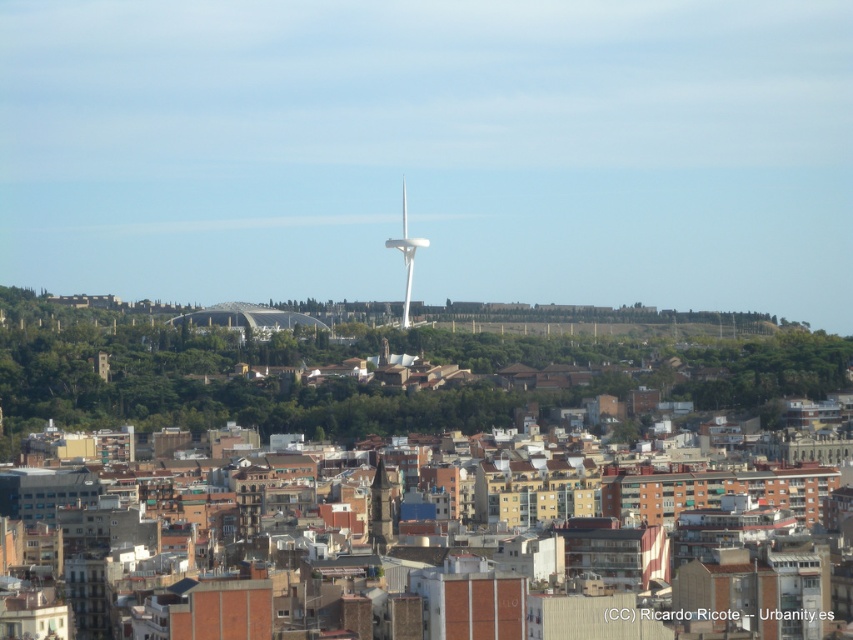
You are standing at the vantage point overlooking the city. You notice two points marked in the image. Which point, point (373, 538) or point (405, 237), is closer to your current position?

Point (373, 538) is closer to the camera than point (405, 237).

You are a city planner evaluating the placement of the dark brown stone tower at center and the white smooth wind turbine at center. Given that the minimum required distance between such structures for safety regulations is 50 meters, do you think their current placement meets the safety standards?

The dark brown stone tower at center and the white smooth wind turbine at center are 45.81 meters apart from each other. Since the required distance is 50 meters, their current placement does not meet the safety standards as they are 4.19 meters too close.